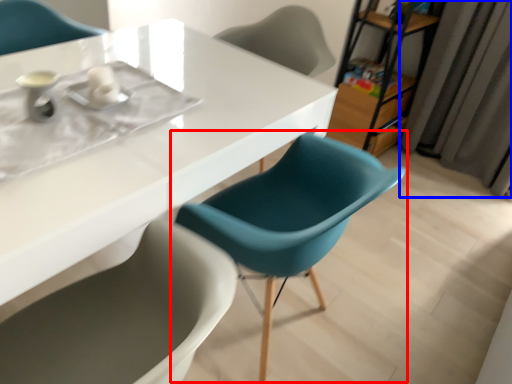
Question: Which object appears farthest to the camera in this image, chair (highlighted by a red box) or curtain (highlighted by a blue box)?

Choices:
 (A) chair
 (B) curtain

Answer: (B)